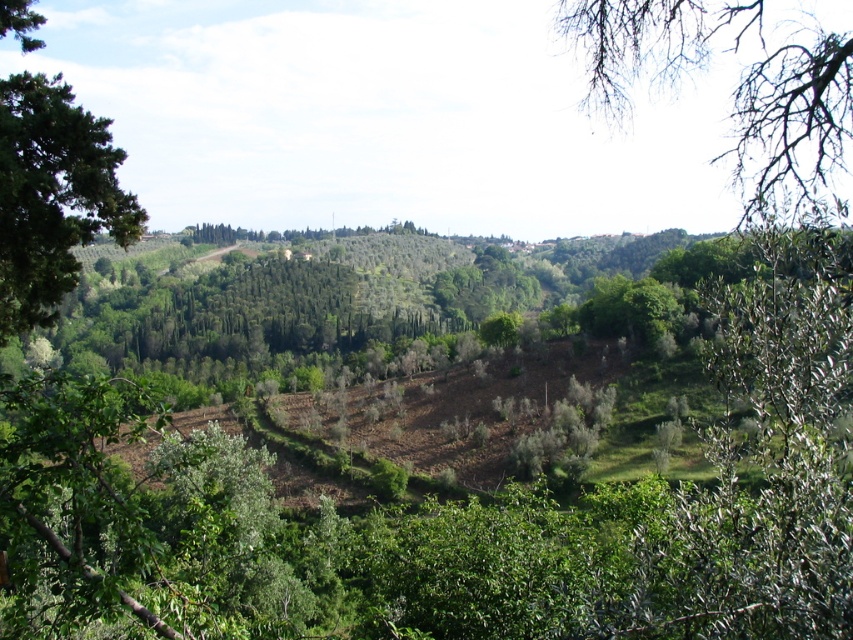
Question: Can you confirm if bare branches at upper right is positioned to the right of green leafy tree at left?

Choices:
 (A) yes
 (B) no

Answer: (A)

Question: Can you confirm if bare branches at upper right is thinner than green leafy tree at left?

Choices:
 (A) yes
 (B) no

Answer: (B)

Question: Which of the following is the farthest from the observer?

Choices:
 (A) (80, 234)
 (B) (587, 52)

Answer: (B)

Question: Among these points, which one is nearest to the camera?

Choices:
 (A) (41, 120)
 (B) (820, 204)

Answer: (B)

Question: Is bare branches at upper right wider than green leafy tree at left?

Choices:
 (A) yes
 (B) no

Answer: (A)